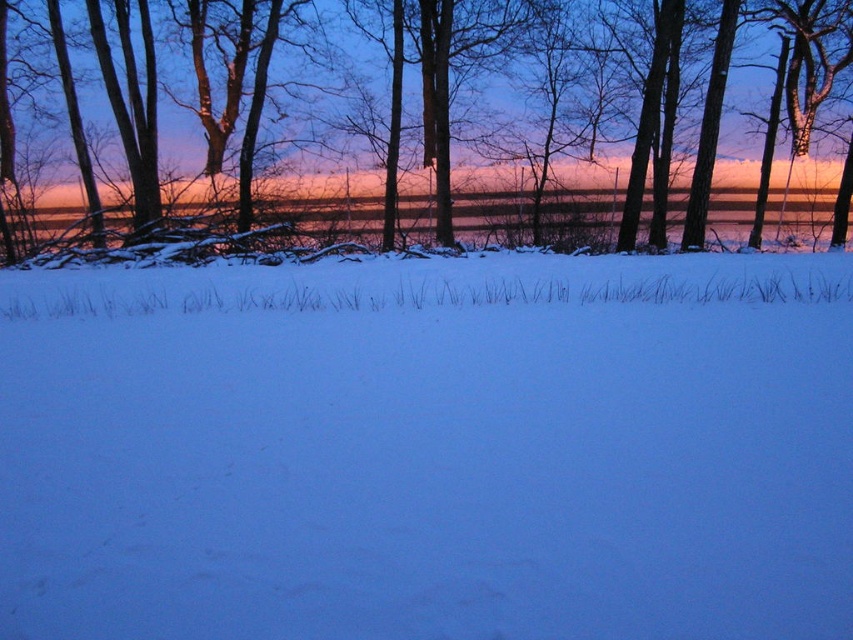
Question: Does smooth bark tree at upper center appear on the right side of shiny metallic water at center?

Choices:
 (A) no
 (B) yes

Answer: (B)

Question: Which object is the farthest from the white powder snow at center?

Choices:
 (A) smooth bark tree at upper center
 (B) shiny metallic water at center

Answer: (A)

Question: Among these points, which one is farthest from the camera?

Choices:
 (A) (18, 221)
 (B) (746, 378)
 (C) (119, 205)

Answer: (C)

Question: Does white powder snow at center have a smaller size compared to smooth bark tree at upper center?

Choices:
 (A) no
 (B) yes

Answer: (B)

Question: Is smooth bark tree at upper center above shiny metallic water at center?

Choices:
 (A) no
 (B) yes

Answer: (B)

Question: Among these objects, which one is farthest from the camera?

Choices:
 (A) white powder snow at center
 (B) shiny metallic water at center
 (C) smooth bark tree at upper center

Answer: (B)